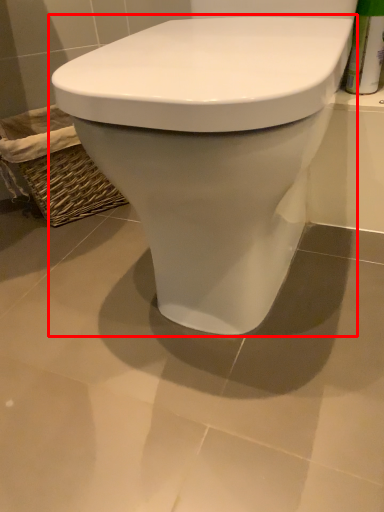
Question: Considering the relative positions of toilet (annotated by the red box) and basket in the image provided, where is toilet (annotated by the red box) located with respect to the staircase?

Choices:
 (A) right
 (B) left

Answer: (A)